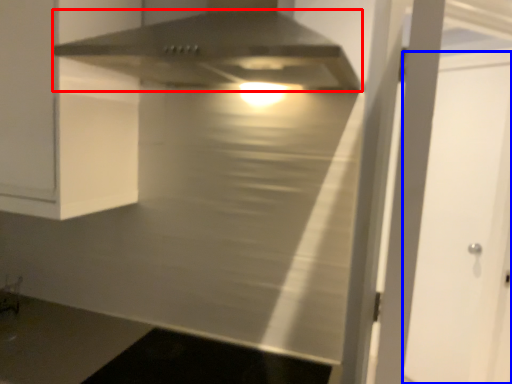
Question: Which object appears closest to the camera in this image, home appliance (highlighted by a red box) or glass door (highlighted by a blue box)?

Choices:
 (A) home appliance
 (B) glass door

Answer: (A)